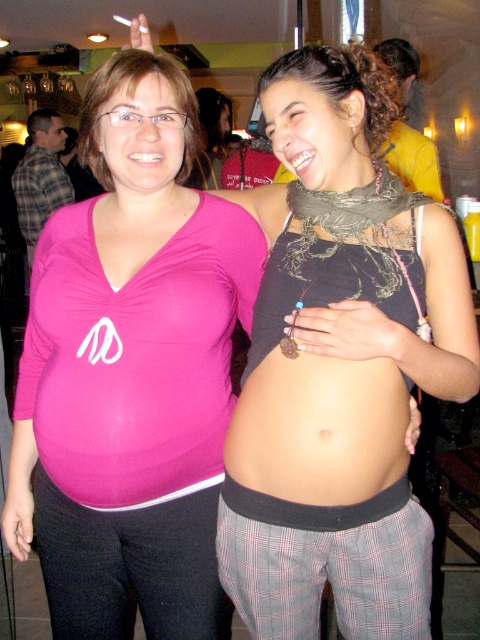
You are at a social event and want to locate the pink matte shirt at left. Where should you look?

You should look at point (131, 369) to find the pink matte shirt at left.

You are an AI analyzing the image. The scene shows two pregnant individuals standing together. The person on the left wears a bright pink top with a white logo, while the person on the right has a black tank top and plaid pants. Based on their positions in the image, which individual is wearing the matte black tank top at center?

The individual on the right is wearing the matte black tank top at center.